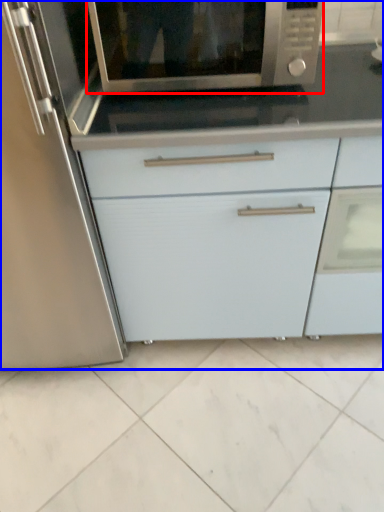
Question: Among these objects, which one is nearest to the camera, microwave oven (highlighted by a red box) or cabinetry (highlighted by a blue box)?

Choices:
 (A) microwave oven
 (B) cabinetry

Answer: (A)